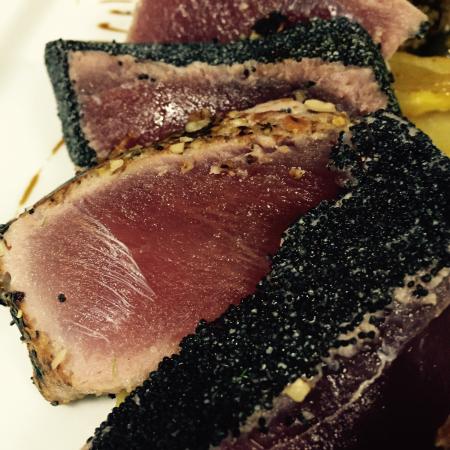
The image size is (450, 450). Identify the location of lower right hand corner inside. (x=435, y=442).